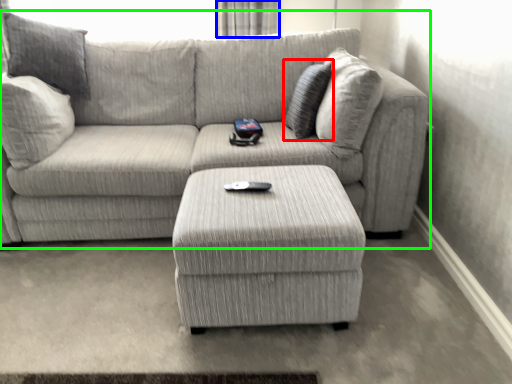
Question: Based on their relative distances, which object is nearer to pillow (highlighted by a red box)? Choose from curtain (highlighted by a blue box) and studio couch (highlighted by a green box).

Choices:
 (A) curtain
 (B) studio couch

Answer: (B)